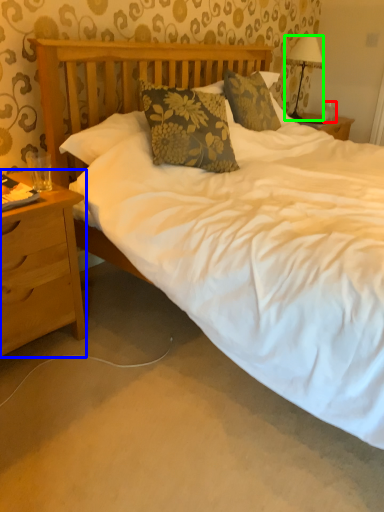
Question: Which object is positioned farthest from coffee cup (highlighted by a red box)? Select from nightstand (highlighted by a blue box) and lamp (highlighted by a green box).

Choices:
 (A) nightstand
 (B) lamp

Answer: (A)